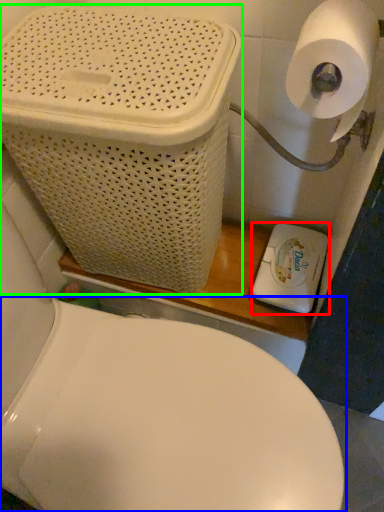
Question: Which object is the closest to the appliance (highlighted by a red box)? Choose among these: toilet (highlighted by a blue box) or basket container (highlighted by a green box).

Choices:
 (A) toilet
 (B) basket container

Answer: (A)